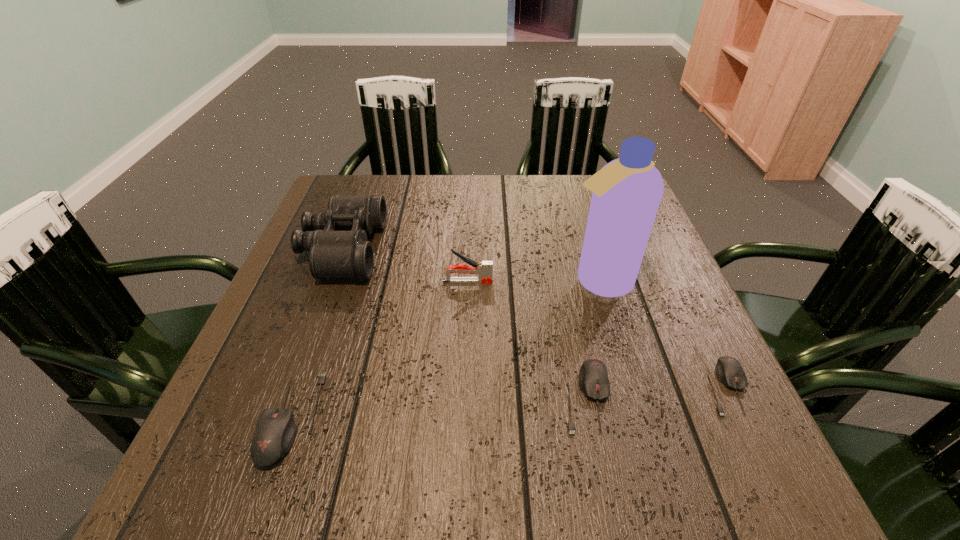
Please point a location where one more mouse_(computer_equipment) can be added evenly. Please provide its 2D coordinates. Your answer should be formatted as a tuple, i.e. [(x, y)], where the tuple contains the x and y coordinates of a point satisfying the conditions above.

[(442, 407)]